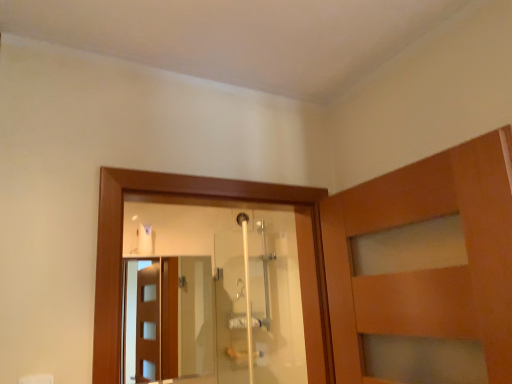
You are a GUI agent. You are given a task and a screenshot of the screen. Output one action in this format:
    pyautogui.click(x=<x>, y=<y>)
    Task: Click on the transparent glass shower door at center
    Image resolution: width=512 pixels, height=384 pixels.
    Given the screenshot: What is the action you would take?
    pyautogui.click(x=240, y=298)

The height and width of the screenshot is (384, 512). What do you see at coordinates (240, 298) in the screenshot?
I see `transparent glass shower door at center` at bounding box center [240, 298].

What is the approximate height of transparent glass shower door at center?

transparent glass shower door at center is 34.48 inches in height.

The width and height of the screenshot is (512, 384). Describe the element at coordinates (168, 320) in the screenshot. I see `transparent glass screen door at center` at that location.

Find the location of a particular element. This screenshot has width=512, height=384. transparent glass screen door at center is located at coordinates click(x=168, y=320).

Locate an element on the screen. The width and height of the screenshot is (512, 384). transparent glass shower door at center is located at coordinates (240, 298).

Considering the positions of objects transparent glass screen door at center and transparent glass shower door at center in the image provided, who is more to the left, transparent glass screen door at center or transparent glass shower door at center?

From the viewer's perspective, transparent glass screen door at center appears more on the left side.

Consider the image. Which is behind, transparent glass screen door at center or transparent glass shower door at center?

transparent glass screen door at center.

Does point (166, 376) come in front of point (227, 274)?

No, it is not.

Based on the photo, from the image's perspective, which is above, transparent glass screen door at center or transparent glass shower door at center?

From the image's view, transparent glass shower door at center is above.

From a real-world perspective, which object stands above the other?

transparent glass shower door at center is physically above.

Can you confirm if transparent glass screen door at center is thinner than transparent glass shower door at center?

Incorrect, the width of transparent glass screen door at center is not less than that of transparent glass shower door at center.

Does transparent glass screen door at center have a lesser height compared to transparent glass shower door at center?

Yes.

In the scene shown: Can you confirm if transparent glass screen door at center is bigger than transparent glass shower door at center?

Yes, transparent glass screen door at center is bigger than transparent glass shower door at center.

Could transparent glass shower door at center be considered to be inside transparent glass screen door at center?

Definitely not — transparent glass shower door at center is not inside transparent glass screen door at center.

Based on the photo, are transparent glass screen door at center and transparent glass shower door at center making contact?

No.

Is transparent glass screen door at center turned away from transparent glass shower door at center?

No, transparent glass screen door at center's orientation is not away from transparent glass shower door at center.

How different are the orientations of transparent glass screen door at center and transparent glass shower door at center in degrees?

They differ by 89.9 degrees in their facing directions.

Measure the distance between transparent glass screen door at center and transparent glass shower door at center.

39.62 centimeters.

At what (x,y) coordinates should I click in order to perform the action: click on shower door lying on the right of transparent glass screen door at center. Please return your answer as a coordinate pair (x, y). Looking at the image, I should click on (240, 298).

Between transparent glass shower door at center and transparent glass screen door at center, which one appears on the right side from the viewer's perspective?

Positioned to the right is transparent glass shower door at center.

Does transparent glass shower door at center lie in front of transparent glass screen door at center?

Yes.

Does point (244, 377) appear closer or farther from the camera than point (164, 350)?

Clearly, point (244, 377) is closer to the camera than point (164, 350).

From the image's perspective, is transparent glass shower door at center beneath transparent glass screen door at center?

No, from the image's perspective, transparent glass shower door at center is not beneath transparent glass screen door at center.

From a real-world perspective, is transparent glass shower door at center physically above transparent glass screen door at center?

Correct, in the physical world, transparent glass shower door at center is higher than transparent glass screen door at center.

Which object is thinner, transparent glass shower door at center or transparent glass screen door at center?

transparent glass shower door at center is thinner.

Considering the sizes of objects transparent glass shower door at center and transparent glass screen door at center in the image provided, who is taller, transparent glass shower door at center or transparent glass screen door at center?

With more height is transparent glass shower door at center.

Who is smaller, transparent glass shower door at center or transparent glass screen door at center?

With smaller size is transparent glass shower door at center.

Is transparent glass shower door at center situated inside transparent glass screen door at center or outside?

transparent glass shower door at center is spatially situated outside transparent glass screen door at center.

Are transparent glass shower door at center and transparent glass screen door at center beside each other?

transparent glass shower door at center is not next to transparent glass screen door at center, and they're not touching.

Based on the photo, is transparent glass shower door at center oriented away from transparent glass screen door at center?

That's not correct — transparent glass shower door at center is not looking away from transparent glass screen door at center.

From the picture: Measure the distance from transparent glass shower door at center to transparent glass screen door at center.

The distance of transparent glass shower door at center from transparent glass screen door at center is 39.62 centimeters.

I want to click on screen door below the transparent glass shower door at center (from a real-world perspective), so click(168, 320).

Find the location of a particular element. This screenshot has height=384, width=512. screen door below the transparent glass shower door at center (from the image's perspective) is located at coordinates (168, 320).

The height and width of the screenshot is (384, 512). I want to click on shower door in front of the transparent glass screen door at center, so click(240, 298).